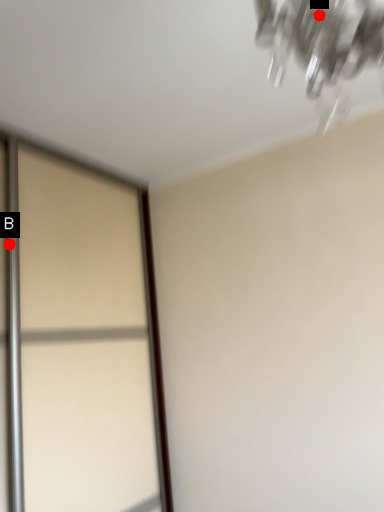
Question: Two points are circled on the image, labeled by A and B beside each circle. Which point appears closest to the camera in this image?

Choices:
 (A) A is closer
 (B) B is closer

Answer: (A)